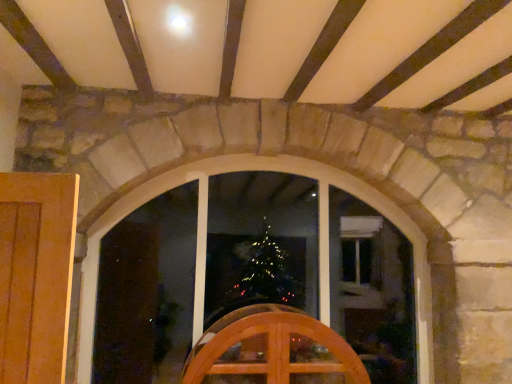
Question: Does clear glass window at center have a lesser height compared to wooden chair at center?

Choices:
 (A) no
 (B) yes

Answer: (A)

Question: Is clear glass window at center looking in the opposite direction of wooden chair at center?

Choices:
 (A) yes
 (B) no

Answer: (A)

Question: Is clear glass window at center beside wooden chair at center?

Choices:
 (A) yes
 (B) no

Answer: (B)

Question: Can you confirm if clear glass window at center is positioned to the left of wooden chair at center?

Choices:
 (A) yes
 (B) no

Answer: (A)

Question: Is clear glass window at center oriented towards wooden chair at center?

Choices:
 (A) no
 (B) yes

Answer: (B)

Question: Is wooden chair at center a part of clear glass window at center?

Choices:
 (A) no
 (B) yes

Answer: (A)

Question: Does wooden chair at center have a lesser height compared to clear glass window at center?

Choices:
 (A) yes
 (B) no

Answer: (A)

Question: Is wooden chair at center taller than clear glass window at center?

Choices:
 (A) yes
 (B) no

Answer: (B)

Question: Is wooden chair at center next to clear glass window at center and touching it?

Choices:
 (A) yes
 (B) no

Answer: (B)

Question: From the image's perspective, is wooden chair at center located beneath clear glass window at center?

Choices:
 (A) no
 (B) yes

Answer: (B)

Question: Does wooden chair at center turn towards clear glass window at center?

Choices:
 (A) yes
 (B) no

Answer: (B)

Question: From a real-world perspective, is wooden chair at center located higher than clear glass window at center?

Choices:
 (A) yes
 (B) no

Answer: (B)

Question: In terms of height, does wooden chair at center look taller or shorter compared to clear glass window at center?

Choices:
 (A) tall
 (B) short

Answer: (B)